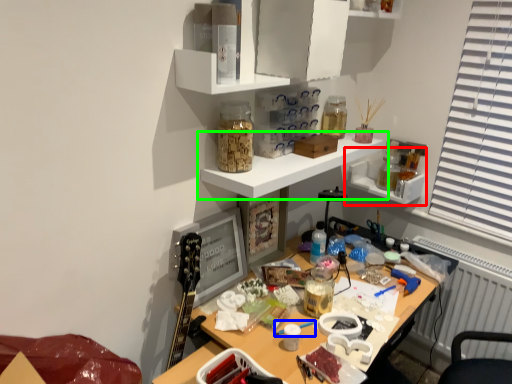
Question: Which is farther away from shelf (highlighted by a red box)? paint brush (highlighted by a blue box) or shelf (highlighted by a green box)?

Choices:
 (A) paint brush
 (B) shelf

Answer: (A)